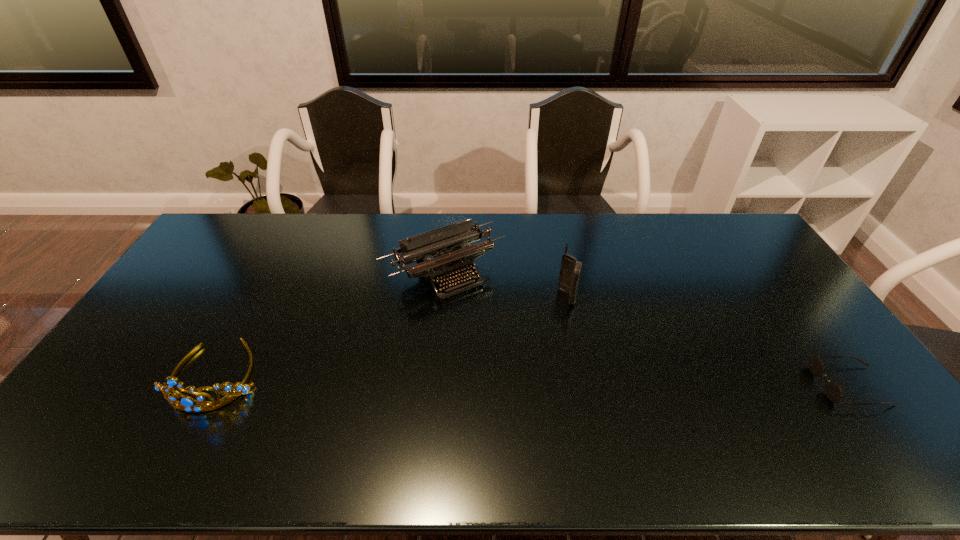
This screenshot has height=540, width=960. In order to click on free space on the desktop that is between the tiara and the rightmost object and is positioned on the typing side of the second object from left to right in this screenshot , I will do `click(524, 380)`.

I want to click on vacant spot on the desktop that is between the leftmost object and the rightmost object and is positioned on the keyboard of the cellular telephone, so click(473, 379).